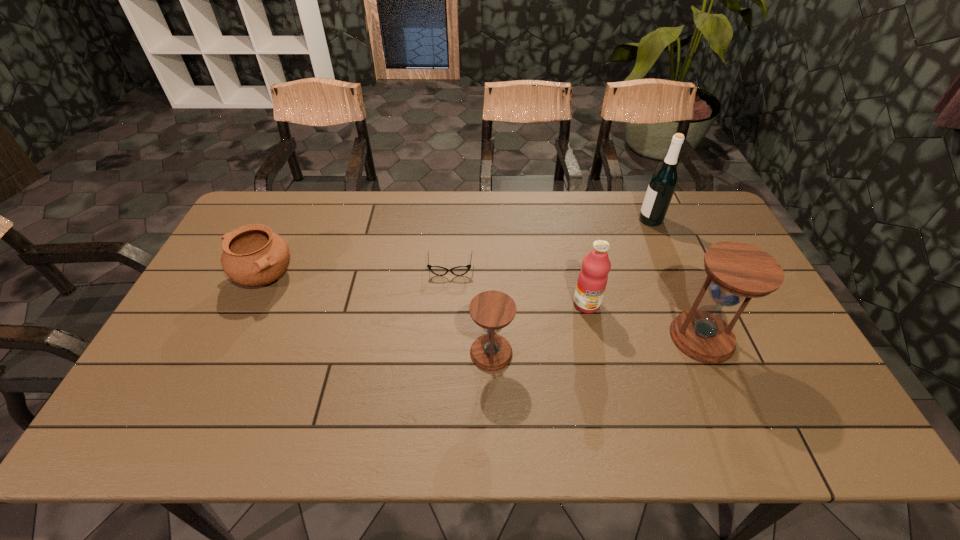
In the current image, all hourglasss are evenly spaced. To maintain this equal spacing, where should an additional hourglass be placed on the left? Please point out a free spot. Please provide its 2D coordinates. Your answer should be formatted as a tuple, i.e. [(x, y)], where the tuple contains the x and y coordinates of a point satisfying the conditions above.

[(268, 369)]